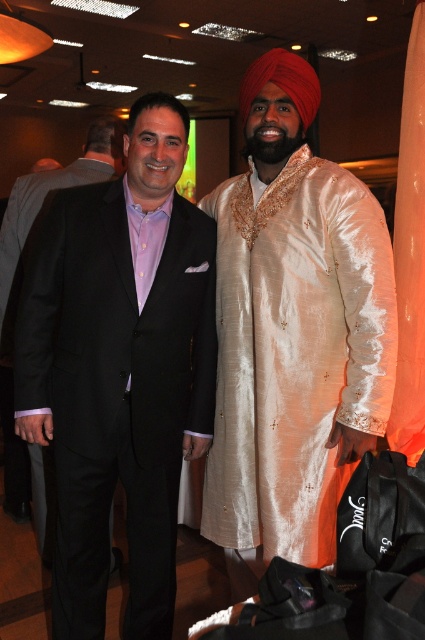
Is black satin suit at left further to camera compared to silky cream kurta at center?

No, black satin suit at left is in front of silky cream kurta at center.

Can you confirm if black satin suit at left is wider than silky cream kurta at center?

Yes, black satin suit at left is wider than silky cream kurta at center.

Identify the location of black satin suit at left. coord(119,369).

Locate an element on the screen. This screenshot has width=425, height=640. silky cream kurta at center is located at coordinates (294, 353).

Does silky cream kurta at center have a lesser height compared to matte black suit at left?

No, silky cream kurta at center is not shorter than matte black suit at left.

Is point (306, 554) closer to viewer compared to point (10, 198)?

Yes, point (306, 554) is closer to viewer.

Locate an element on the screen. The height and width of the screenshot is (640, 425). silky cream kurta at center is located at coordinates (294, 353).

Who is lower down, black satin suit at left or matte black suit at left?

black satin suit at left

Between point (139, 480) and point (11, 243), which one is positioned behind?

Positioned behind is point (11, 243).

Describe the element at coordinates (119, 369) in the screenshot. I see `black satin suit at left` at that location.

The width and height of the screenshot is (425, 640). What are the coordinates of `black satin suit at left` in the screenshot? It's located at (119, 369).